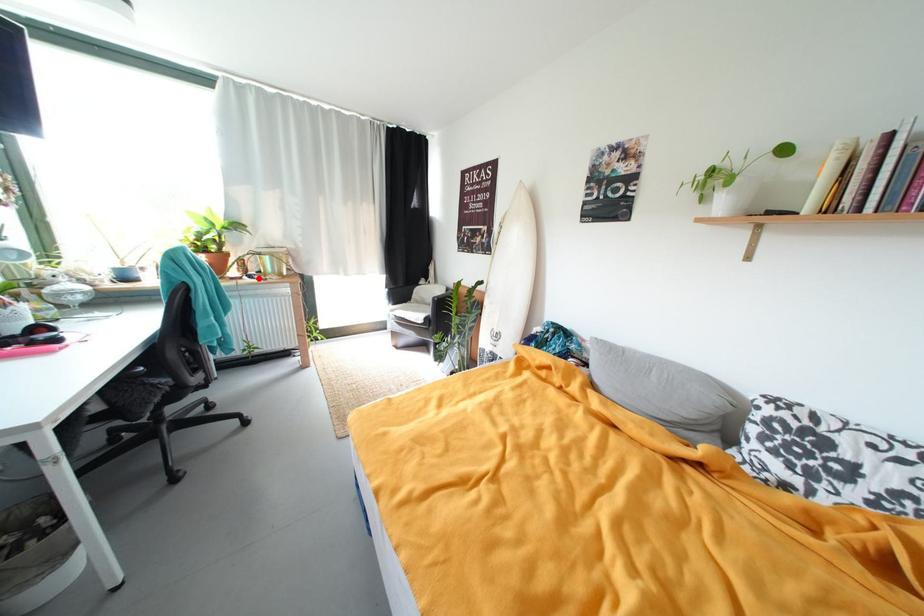
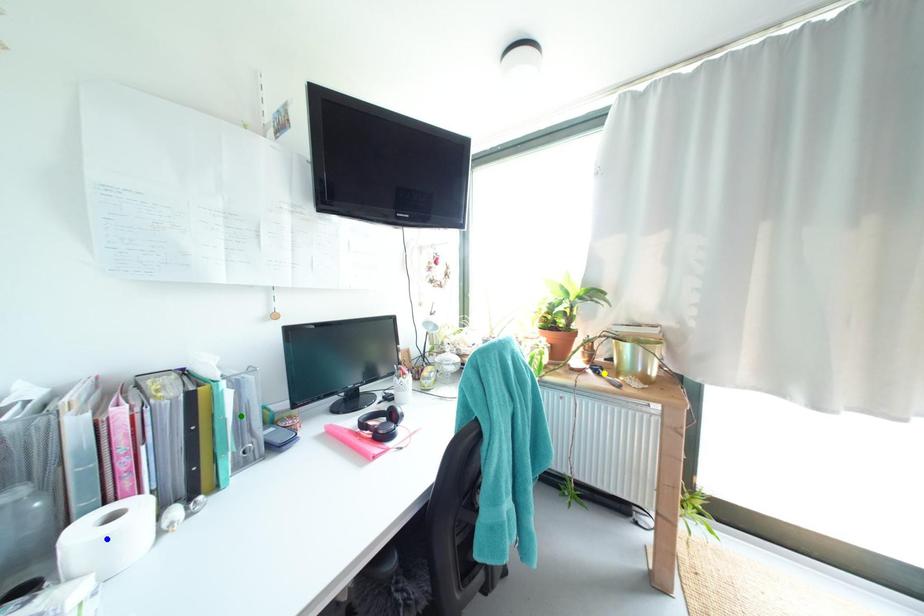
Question: I am providing you with two images of the same scene from different viewpoints. A red point is marked on the first image. You are given multiple points on the second image. Can you choose the point in image 2 that corresponds to the point in image 1?

Choices:
 (A) green point
 (B) yellow point
 (C) blue point

Answer: (B)